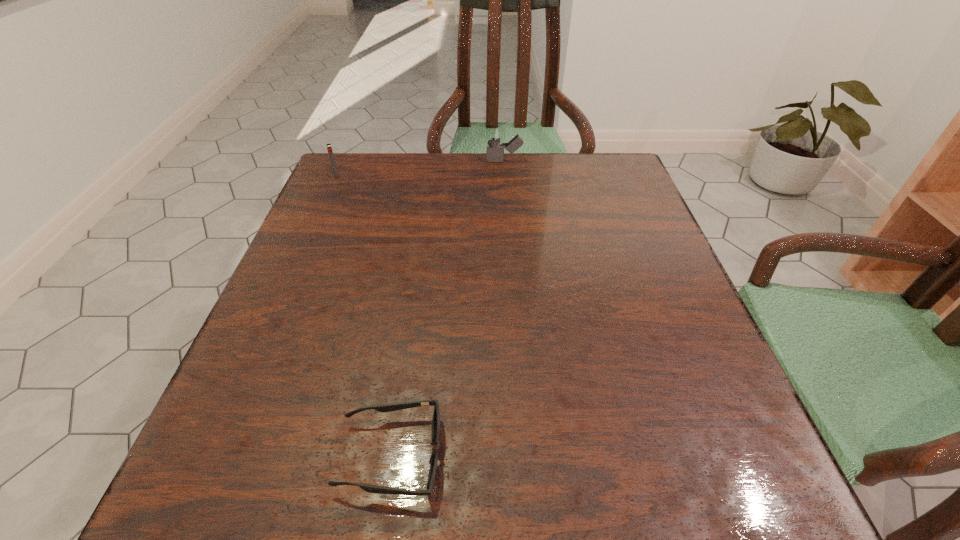
In order to click on object located in the left edge section of the desktop in this screenshot , I will do `click(329, 148)`.

The image size is (960, 540). Find the location of `object positioned at the far left corner`. object positioned at the far left corner is located at coordinates (329, 148).

Where is `vacant space at the far edge of the desktop`? vacant space at the far edge of the desktop is located at coordinates (497, 163).

What are the coordinates of `vacant space at the near edge of the desktop` in the screenshot? It's located at (562, 461).

Where is `vacant space at the left edge of the desktop`? The height and width of the screenshot is (540, 960). vacant space at the left edge of the desktop is located at coordinates (321, 220).

I want to click on vacant space at the right edge, so click(x=678, y=305).

Find the location of `vacant space at the far left corner of the desktop`. vacant space at the far left corner of the desktop is located at coordinates click(324, 186).

At what (x,y) coordinates should I click in order to perform the action: click on free space at the near left corner of the desktop. Please return your answer as a coordinate pair (x, y). Looking at the image, I should click on (206, 500).

You are a GUI agent. You are given a task and a screenshot of the screen. Output one action in this format:
    pyautogui.click(x=<x>, y=<y>)
    Task: Click on the vacant space at the far right corner
    The image size is (960, 540).
    Given the screenshot: What is the action you would take?
    pyautogui.click(x=588, y=189)

Locate an element on the screen. Image resolution: width=960 pixels, height=540 pixels. vacant space at the near right corner of the desktop is located at coordinates (667, 489).